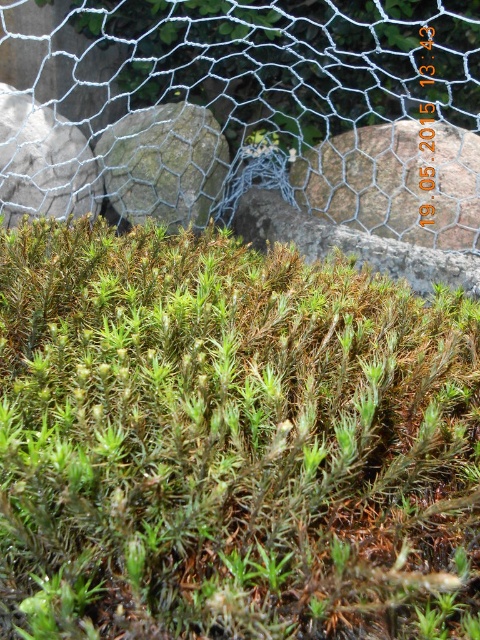
Between gray rock at center and gray rough stone at center, which one is positioned higher?

gray rough stone at center

How distant is gray rock at center from gray rough stone at center?

gray rock at center is 21.11 inches away from gray rough stone at center.

This screenshot has height=640, width=480. What are the coordinates of `gray rock at center` in the screenshot? It's located at (396, 182).

Between wire mesh at upper center and gray rock at center, which one has less height?

gray rock at center is shorter.

Is point (113, 67) closer to camera compared to point (404, 157)?

No, (113, 67) is behind (404, 157).

Is point (288, 38) positioned in front of point (315, 205)?

No, (288, 38) is behind (315, 205).

Find the location of a particular element. The width and height of the screenshot is (480, 640). wire mesh at upper center is located at coordinates (267, 81).

Is wire mesh at upper center to the left of gray rough stone at center from the viewer's perspective?

Indeed, wire mesh at upper center is positioned on the left side of gray rough stone at center.

Is wire mesh at upper center shorter than gray rough stone at center?

In fact, wire mesh at upper center may be taller than gray rough stone at center.

Is point (369, 141) positioned behind point (188, 102)?

That is False.

Where is `wire mesh at upper center`? The height and width of the screenshot is (640, 480). wire mesh at upper center is located at coordinates (267, 81).